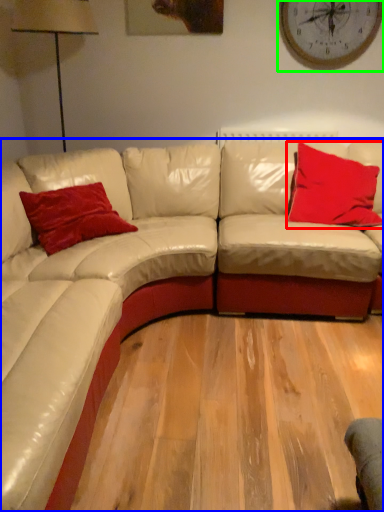
Question: Which object is positioned farthest from pillow (highlighted by a red box)? Select from studio couch (highlighted by a blue box) and clock (highlighted by a green box).

Choices:
 (A) studio couch
 (B) clock

Answer: (B)